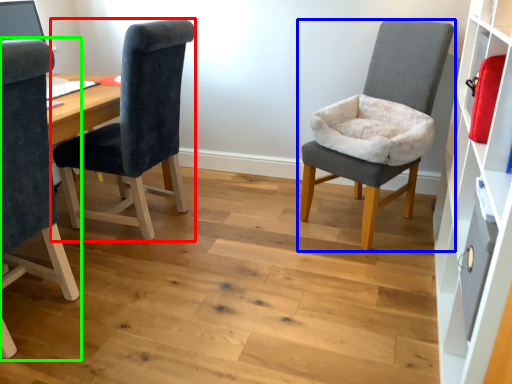
Question: Which object is the farthest from chair (highlighted by a red box)? Choose among these: chair (highlighted by a blue box) or chair (highlighted by a green box).

Choices:
 (A) chair
 (B) chair

Answer: (A)